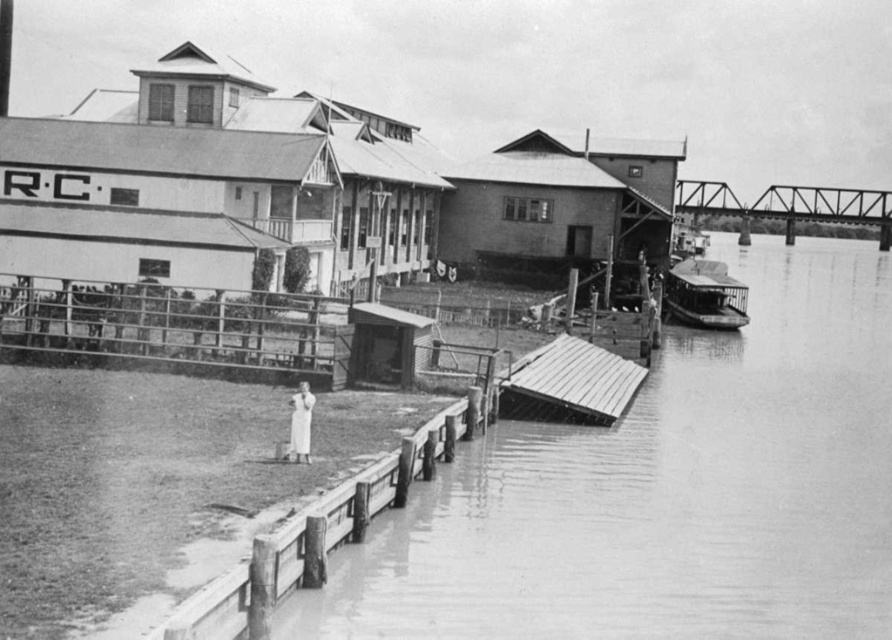
How distant is smooth wooden boat at right from white cotton dress at lower left?

They are 41.35 meters apart.

Can you confirm if smooth wooden boat at right is thinner than white cotton dress at lower left?

No.

Between point (714, 269) and point (308, 403), which one is positioned in front?

Positioned in front is point (308, 403).

The image size is (892, 640). Find the location of `smooth wooden boat at right`. smooth wooden boat at right is located at coordinates (704, 296).

Looking at this image, is metallic gray dock at lower center taller than smooth wooden boat at right?

No, metallic gray dock at lower center is not taller than smooth wooden boat at right.

The width and height of the screenshot is (892, 640). I want to click on metallic gray dock at lower center, so click(568, 384).

Describe the element at coordinates (665, 492) in the screenshot. I see `smooth concrete dock at lower center` at that location.

Is smooth concrete dock at lower center wider than metallic gray dock at lower center?

Correct, the width of smooth concrete dock at lower center exceeds that of metallic gray dock at lower center.

Who is more distant from viewer, (847, 330) or (531, 374)?

Positioned behind is point (847, 330).

Locate an element on the screen. The height and width of the screenshot is (640, 892). smooth concrete dock at lower center is located at coordinates (665, 492).